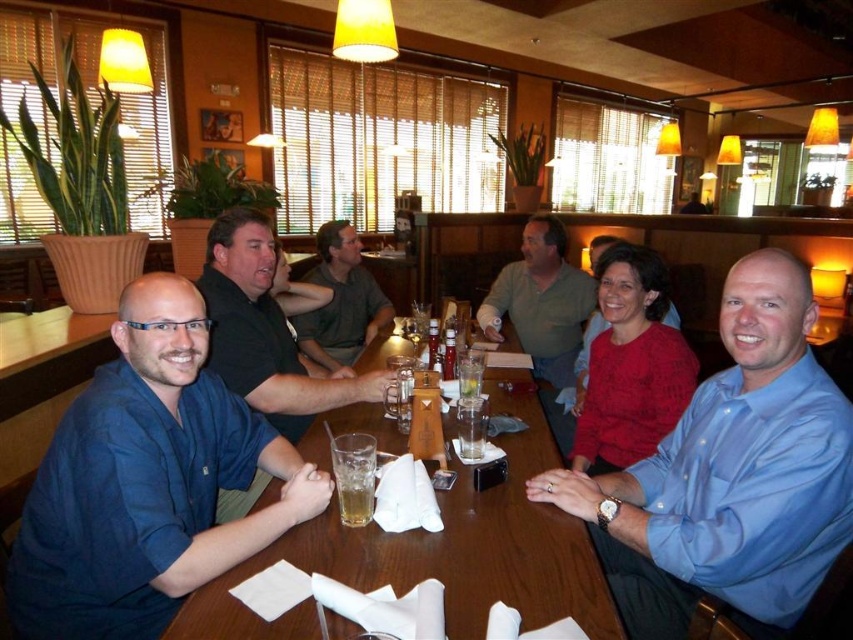
Who is more forward, (322, 573) or (349, 284)?

Positioned in front is point (322, 573).

Who is positioned more to the left, wooden table at center or green fabric shirt at center?

From the viewer's perspective, green fabric shirt at center appears more on the left side.

Who is more forward, [428,557] or [364,298]?

Positioned in front is point [428,557].

Where is `wooden table at center`? This screenshot has width=853, height=640. wooden table at center is located at coordinates (440, 552).

Does blue shirt at left appear on the left side of translucent glass beer at table center?

Indeed, blue shirt at left is positioned on the left side of translucent glass beer at table center.

Is blue shirt at left above translucent glass beer at table center?

Indeed, blue shirt at left is positioned over translucent glass beer at table center.

Describe the element at coordinates (267, 330) in the screenshot. I see `blue shirt at left` at that location.

The height and width of the screenshot is (640, 853). Find the location of `blue shirt at left`. blue shirt at left is located at coordinates (267, 330).

From the picture: Does blue cotton shirt at left have a greater height compared to blue shirt at left?

No.

Is point (267, 442) less distant than point (305, 400)?

Yes, it is in front of point (305, 400).

Where is `blue cotton shirt at left`? The width and height of the screenshot is (853, 640). blue cotton shirt at left is located at coordinates (148, 481).